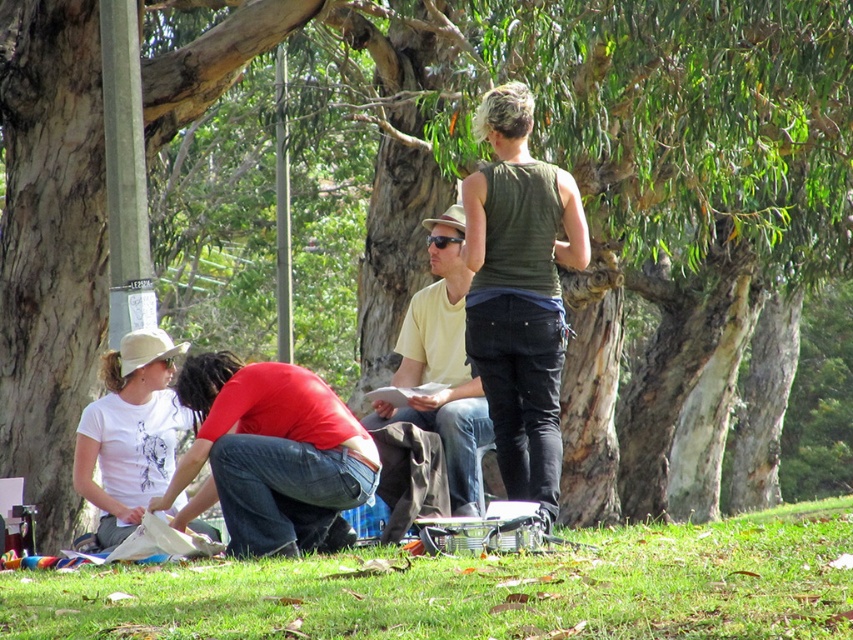
Question: Which of the following is the farthest from the observer?

Choices:
 (A) (456, 436)
 (B) (535, 364)
 (C) (331, 604)
 (D) (108, 428)

Answer: (D)

Question: Does red matte shirt at center have a larger size compared to white matte t-shirt at lower left?

Choices:
 (A) no
 (B) yes

Answer: (A)

Question: Considering the relative positions of green fabric tank top at center and red matte shirt at center in the image provided, where is green fabric tank top at center located with respect to red matte shirt at center?

Choices:
 (A) right
 (B) left

Answer: (A)

Question: Does green grass at lower center appear over green fabric tank top at center?

Choices:
 (A) no
 (B) yes

Answer: (A)

Question: Among these objects, which one is nearest to the camera?

Choices:
 (A) green fabric tank top at center
 (B) red matte shirt at center
 (C) white matte t-shirt at lower left
 (D) yellow matte shirt at center

Answer: (B)

Question: Which object appears closest to the camera in this image?

Choices:
 (A) white matte t-shirt at lower left
 (B) green fabric tank top at center
 (C) green grass at lower center

Answer: (C)